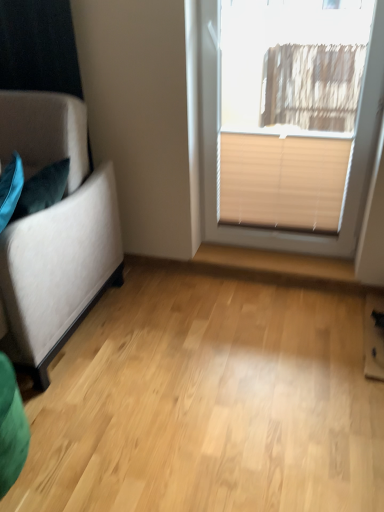
Question: From the image's perspective, is beige blind at upper right positioned above or below suede-like beige couch at left?

Choices:
 (A) above
 (B) below

Answer: (A)

Question: Is beige blind at upper right inside or outside of suede-like beige couch at left?

Choices:
 (A) inside
 (B) outside

Answer: (B)

Question: Which object is the farthest from the beige blind at upper right?

Choices:
 (A) beige fabric blind at upper right
 (B) light wood floor at center
 (C) suede-like beige couch at left

Answer: (B)

Question: Which object is positioned closest to the light wood floor at center?

Choices:
 (A) beige fabric blind at upper right
 (B) beige blind at upper right
 (C) suede-like beige couch at left

Answer: (C)